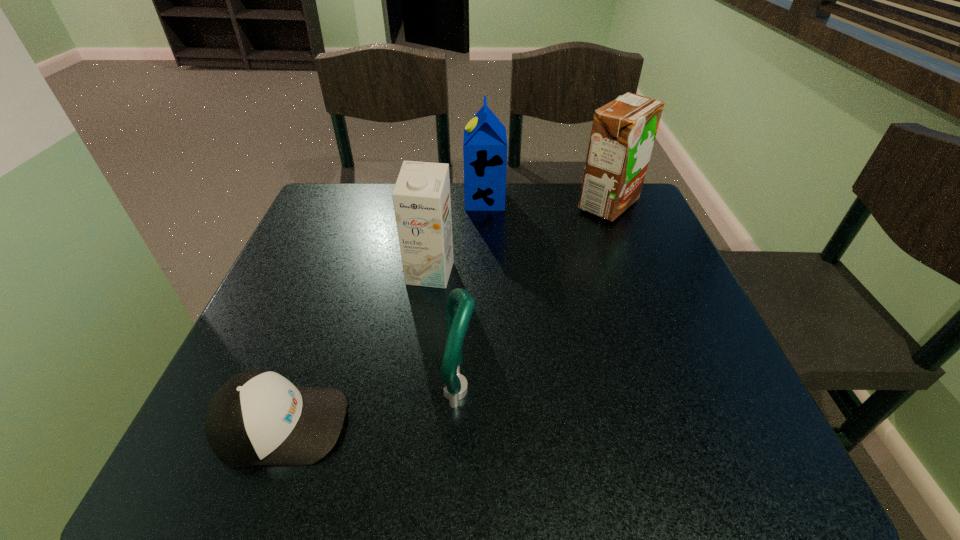
The image size is (960, 540). Identify the location of the rightmost carton. (623, 132).

The width and height of the screenshot is (960, 540). Identify the location of the second carton from right to left. (485, 146).

You are a GUI agent. You are given a task and a screenshot of the screen. Output one action in this format:
    pyautogui.click(x=<x>, y=<y>)
    Task: Click on the nearest carton
    This screenshot has width=960, height=540.
    Given the screenshot: What is the action you would take?
    pyautogui.click(x=421, y=197)

This screenshot has height=540, width=960. Identify the location of the leftmost carton. (421, 197).

Find the location of a particular element. This screenshot has width=960, height=540. bottle opener is located at coordinates (460, 305).

In order to click on the shortest object in this screenshot , I will do `click(258, 417)`.

Identify the location of the leftmost object. Image resolution: width=960 pixels, height=540 pixels. (258, 417).

Where is `free space located 0.070m on the straw side of the rightmost carton`? The width and height of the screenshot is (960, 540). free space located 0.070m on the straw side of the rightmost carton is located at coordinates (549, 205).

You are a GUI agent. You are given a task and a screenshot of the screen. Output one action in this format:
    pyautogui.click(x=<x>, y=<y>)
    Task: Click on the free space located 0.080m on the straw side of the rightmost carton
    Image resolution: width=960 pixels, height=540 pixels.
    Given the screenshot: What is the action you would take?
    pyautogui.click(x=545, y=205)

Where is `vacant region located on the straw side of the rightmost carton`? The height and width of the screenshot is (540, 960). vacant region located on the straw side of the rightmost carton is located at coordinates (553, 205).